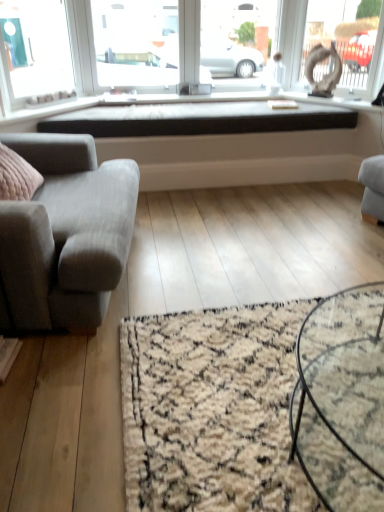
Identify the location of vacant space behind beige shaggy rug at lower center. This screenshot has width=384, height=512. (264, 266).